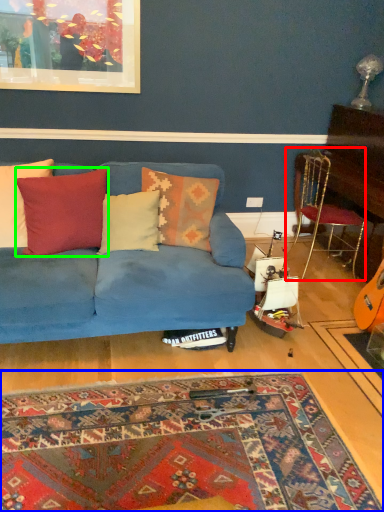
Question: Which is farther away from chair (highlighted by a red box)? mat (highlighted by a blue box) or pillow (highlighted by a green box)?

Choices:
 (A) mat
 (B) pillow

Answer: (A)